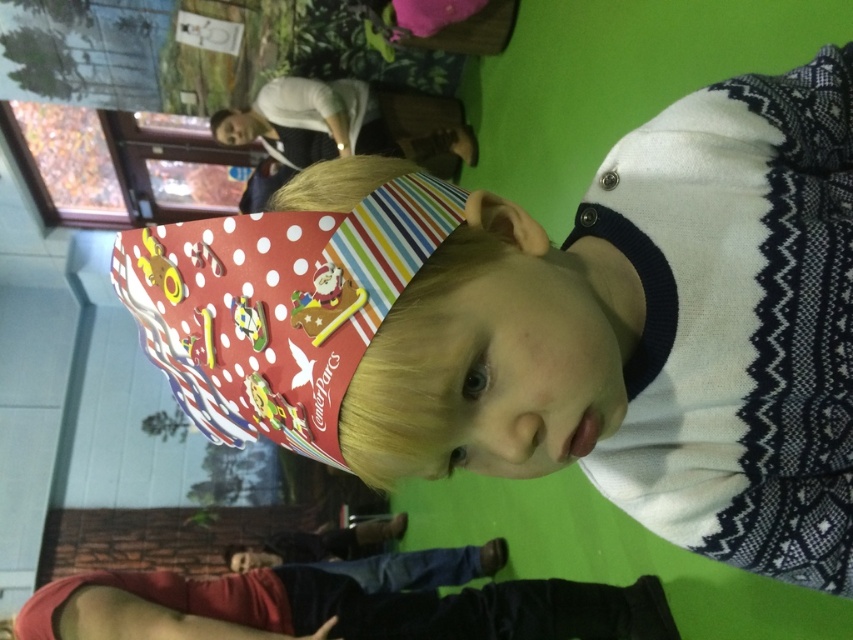
Who is more distant from viewer, [175,600] or [253,557]?

Point [253,557]

Who is lower down, denim pants at lower center or matte plastic head at center?

matte plastic head at center

The height and width of the screenshot is (640, 853). What do you see at coordinates (347, 604) in the screenshot?
I see `denim pants at lower center` at bounding box center [347, 604].

Locate an element on the screen. The image size is (853, 640). denim pants at lower center is located at coordinates (347, 604).

Does point (224, 140) come in front of point (258, 556)?

No.

Who is lower down, matte plastic head at upper center or matte plastic head at center?

matte plastic head at center

Is point (258, 134) positioned before point (277, 556)?

That is False.

This screenshot has height=640, width=853. What are the coordinates of `matte plastic head at upper center` in the screenshot? It's located at (236, 125).

Who is more forward, [321,572] or [244,140]?

Point [321,572]

Is point (495, 616) positioned in front of point (242, 125)?

Yes, it is.

At what (x,y) coordinates should I click in order to perform the action: click on denim pants at lower center. Please return your answer as a coordinate pair (x, y). Image resolution: width=853 pixels, height=640 pixels. Looking at the image, I should click on (347, 604).